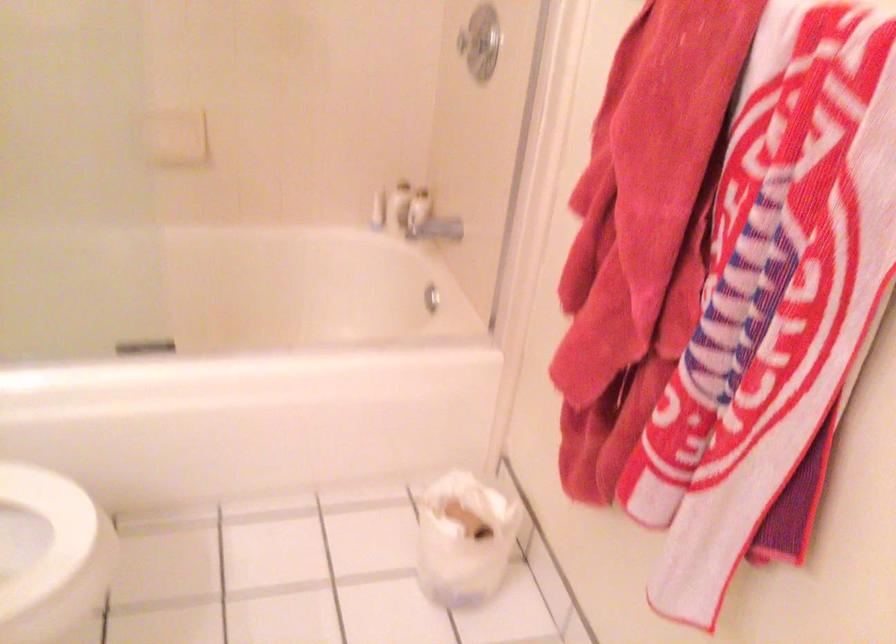
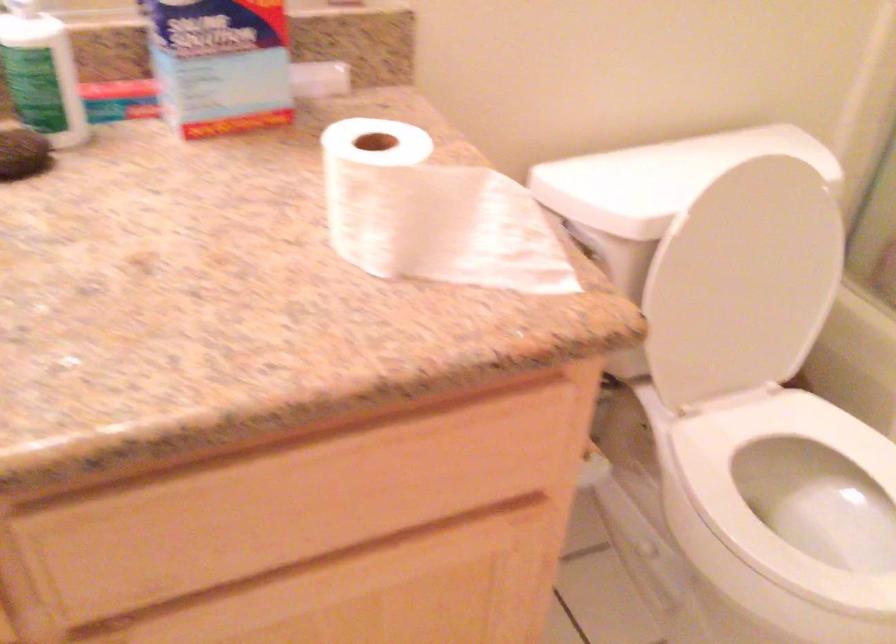
The images are taken continuously from a first-person perspective. In which direction is your viewpoint rotating?

The rotation direction of the camera is left-down.